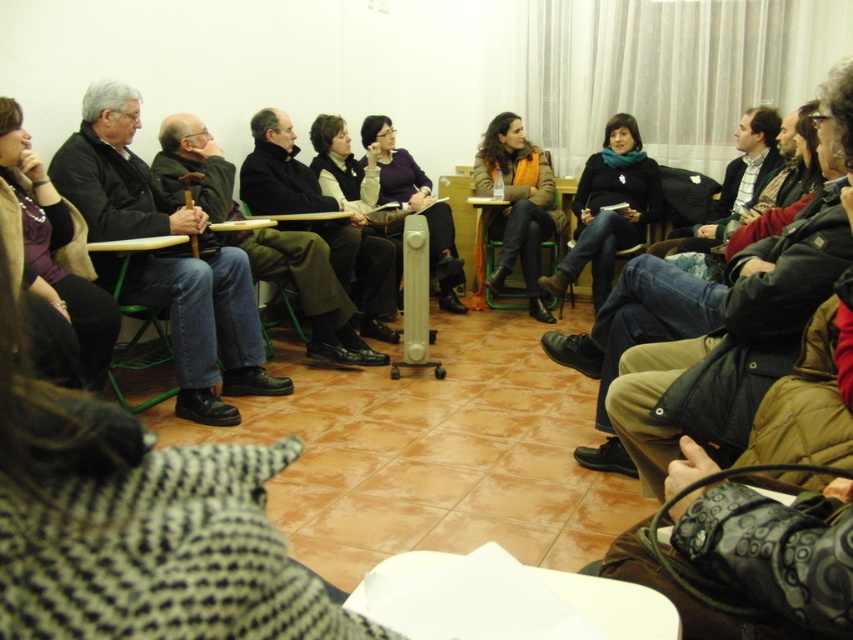
You are standing in the room and want to hand a document to the person wearing the matte black sweater at center. If you are currently 15 feet away from them, can you reach them without moving closer?

The matte black sweater at center is 14.91 feet away from the viewer, so you are already within reach since you are only 15 feet away. However, you might need to step slightly closer to ensure a comfortable handoff.

You are organizing a seating arrangement for an upcoming workshop in the same room. You have a large matte black sweater at center and a green plastic chair at left. Which object takes up more space in the room?

The matte black sweater at center is bigger than the green plastic chair at left, so it takes up more space in the room.

You are standing at the center of the room and want to move towards the point labeled as point (590, 179). However, there is an obstacle at point (131, 340). Can you walk directly to your destination without going around the obstacle?

Since point (590, 179) is behind point (131, 340), you will have to go around the obstacle at point (131, 340) to reach your destination.